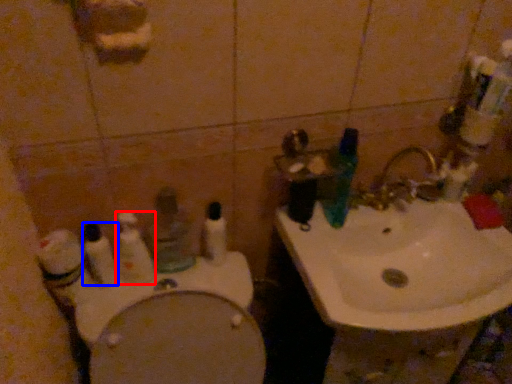
Question: Which of the following is the closest to the observer, toothbrush (highlighted by a red box) or toothbrush (highlighted by a blue box)?

Choices:
 (A) toothbrush
 (B) toothbrush

Answer: (B)